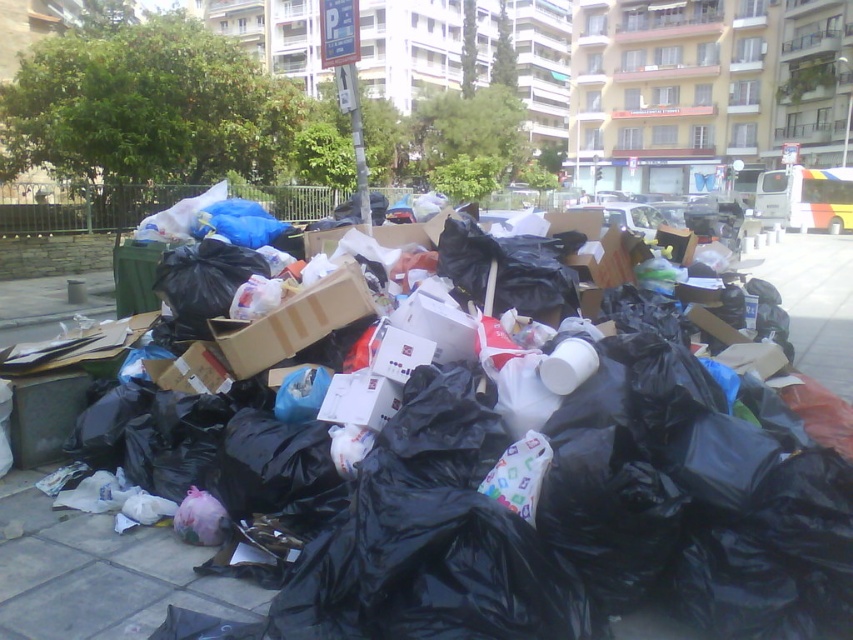
Question: Can you confirm if black plastic bags at center is bigger than brown cardboard box at center?

Choices:
 (A) no
 (B) yes

Answer: (B)

Question: Does black plastic bags at center appear under brown cardboard box at center?

Choices:
 (A) no
 (B) yes

Answer: (A)

Question: Which of the following is the closest to the observer?

Choices:
 (A) (816, 321)
 (B) (289, 320)

Answer: (B)

Question: Where is black plastic bags at center located in relation to brown cardboard box at center in the image?

Choices:
 (A) right
 (B) left

Answer: (A)

Question: Which of the following is the farthest from the observer?

Choices:
 (A) brown cardboard box at center
 (B) black plastic bags at center

Answer: (A)